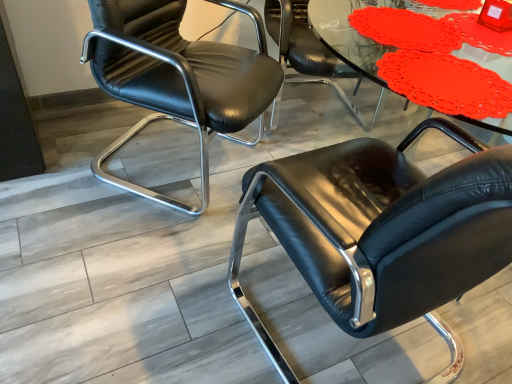
Question: Does black leather chair at center, the first chair positioned from the right, appear on the left side of matte plastic table at upper center?

Choices:
 (A) no
 (B) yes

Answer: (A)

Question: Is black leather chair at center, the first chair positioned from the right, thinner than matte plastic table at upper center?

Choices:
 (A) yes
 (B) no

Answer: (B)

Question: Considering the relative sizes of black leather chair at center, which appears as the third chair when viewed from the left, and matte plastic table at upper center in the image provided, is black leather chair at center, which appears as the third chair when viewed from the left, taller than matte plastic table at upper center?

Choices:
 (A) yes
 (B) no

Answer: (A)

Question: Does black leather chair at center, which appears as the third chair when viewed from the left, come behind matte plastic table at upper center?

Choices:
 (A) no
 (B) yes

Answer: (A)

Question: Is black leather chair at center, the first chair positioned from the right, in front of matte plastic table at upper center?

Choices:
 (A) yes
 (B) no

Answer: (A)

Question: Is point (104, 71) positioned closer to the camera than point (430, 284)?

Choices:
 (A) closer
 (B) farther

Answer: (B)

Question: Looking at the image, does black leather chair at left, marked as the 3th chair in a right-to-left arrangement, seem bigger or smaller compared to black leather chair at center, the first chair positioned from the right?

Choices:
 (A) big
 (B) small

Answer: (B)

Question: Looking at their shapes, would you say black leather chair at left, marked as the 3th chair in a right-to-left arrangement, is wider or thinner than black leather chair at center, the first chair positioned from the right?

Choices:
 (A) thin
 (B) wide

Answer: (A)

Question: In terms of height, does black leather chair at left, marked as the 3th chair in a right-to-left arrangement, look taller or shorter compared to black leather chair at center, which appears as the third chair when viewed from the left?

Choices:
 (A) short
 (B) tall

Answer: (B)

Question: Is matte plastic table at upper center spatially inside black leather chair at center, the first chair positioned from the right, or outside of it?

Choices:
 (A) inside
 (B) outside

Answer: (A)

Question: Considering the positions of matte plastic table at upper center and black leather chair at center, which appears as the third chair when viewed from the left, in the image, is matte plastic table at upper center wider or thinner than black leather chair at center, which appears as the third chair when viewed from the left,?

Choices:
 (A) thin
 (B) wide

Answer: (A)

Question: Does point (360, 41) appear closer or farther from the camera than point (483, 160)?

Choices:
 (A) farther
 (B) closer

Answer: (A)

Question: Is matte plastic table at upper center bigger or smaller than black leather chair at center, the first chair positioned from the right?

Choices:
 (A) small
 (B) big

Answer: (A)

Question: Considering the positions of matte plastic table at upper center and black leather chair at center, which is counted as the second chair, starting from the right, in the image, is matte plastic table at upper center wider or thinner than black leather chair at center, which is counted as the second chair, starting from the right,?

Choices:
 (A) wide
 (B) thin

Answer: (B)

Question: Considering the positions of matte plastic table at upper center and black leather chair at center, the second chair when ordered from left to right, in the image, is matte plastic table at upper center taller or shorter than black leather chair at center, the second chair when ordered from left to right,?

Choices:
 (A) tall
 (B) short

Answer: (B)